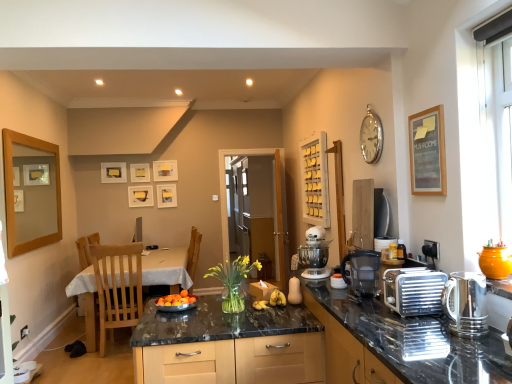
In order to click on vacant space situated on the left part of black plastic water filter at center, which appears as the 2th kitchen appliance when viewed from the right in this screenshot , I will do `click(333, 295)`.